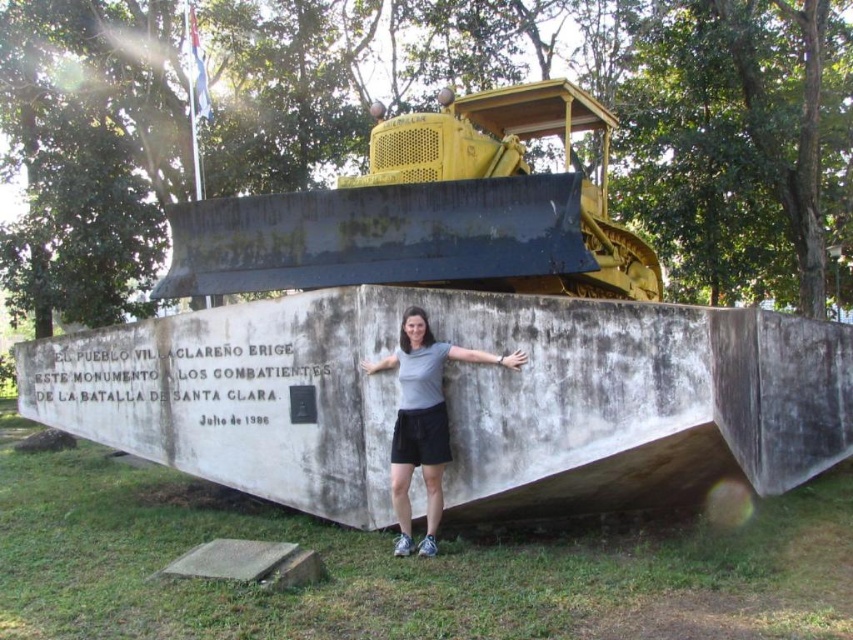
You are a tour guide leading a group near the monument. You want to point out both the yellow metallic bulldozer at upper center and the gray fabric shirt at center to your group. If you stand at the base of the monument, which object will you need to point to first as you move your hand from left to right?

The gray fabric shirt at center is located to the left of the yellow metallic bulldozer at upper center. Therefore, when moving your hand from left to right, you would first point to the gray fabric shirt at center before pointing to the yellow metallic bulldozer at upper center.

You are a tourist visiting the monument and want to take a photo that includes both the yellow metallic bulldozer at upper center and the gray fabric shirt at center. Based on their positions, which object should you position to the left side of your camera frame to include both?

To include both the yellow metallic bulldozer at upper center and the gray fabric shirt at center in your photo, you should position the yellow metallic bulldozer at upper center to the left side of your camera frame since it is already to the left of the gray fabric shirt at center.